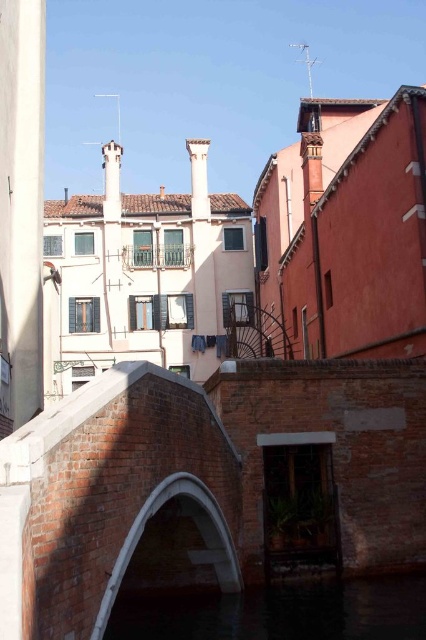
From the picture: Which of these two, dark water at bridge center or white stone archway at center, stands taller?

Standing taller between the two is white stone archway at center.

Measure the distance between dark water at bridge center and white stone archway at center.

They are 5.09 meters apart.

The height and width of the screenshot is (640, 426). Describe the element at coordinates (282, 612) in the screenshot. I see `dark water at bridge center` at that location.

This screenshot has height=640, width=426. Identify the location of dark water at bridge center. (282, 612).